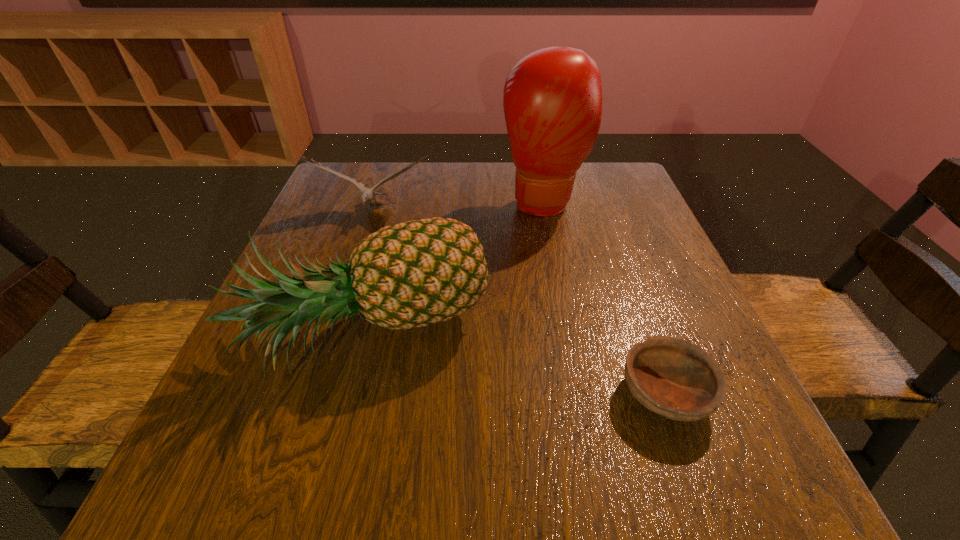
Image resolution: width=960 pixels, height=540 pixels. In the image, there is a desktop. Identify the location of vacant space at the far right corner. (636, 199).

This screenshot has width=960, height=540. I want to click on blank space at the near right corner, so click(710, 502).

Find the location of a particular element. Image resolution: width=960 pixels, height=540 pixels. vacant space that is in between the gull and the boxing glove is located at coordinates (459, 207).

You are a GUI agent. You are given a task and a screenshot of the screen. Output one action in this format:
    pyautogui.click(x=<x>, y=<y>)
    Task: Click on the free space between the shortest object and the gull
    Image resolution: width=960 pixels, height=540 pixels.
    Given the screenshot: What is the action you would take?
    pyautogui.click(x=519, y=303)

The image size is (960, 540). What are the coordinates of `free area in between the third tallest object and the shortest object` in the screenshot? It's located at (519, 303).

The image size is (960, 540). Identify the location of free point between the boxing glove and the second shortest object. click(459, 207).

Where is `blank region between the tallest object and the gull`? The height and width of the screenshot is (540, 960). blank region between the tallest object and the gull is located at coordinates (459, 207).

Find the location of a particular element. free space that is in between the boxing glove and the gull is located at coordinates (459, 207).

You are a GUI agent. You are given a task and a screenshot of the screen. Output one action in this format:
    pyautogui.click(x=<x>, y=<y>)
    Task: Click on the vacant space that is in between the shortest object and the pineapple
    
    Given the screenshot: What is the action you would take?
    pyautogui.click(x=517, y=365)

At what (x,y) coordinates should I click in order to perform the action: click on free space between the tallest object and the bowl. Please return your answer as a coordinate pair (x, y). Image resolution: width=960 pixels, height=540 pixels. Looking at the image, I should click on (605, 298).